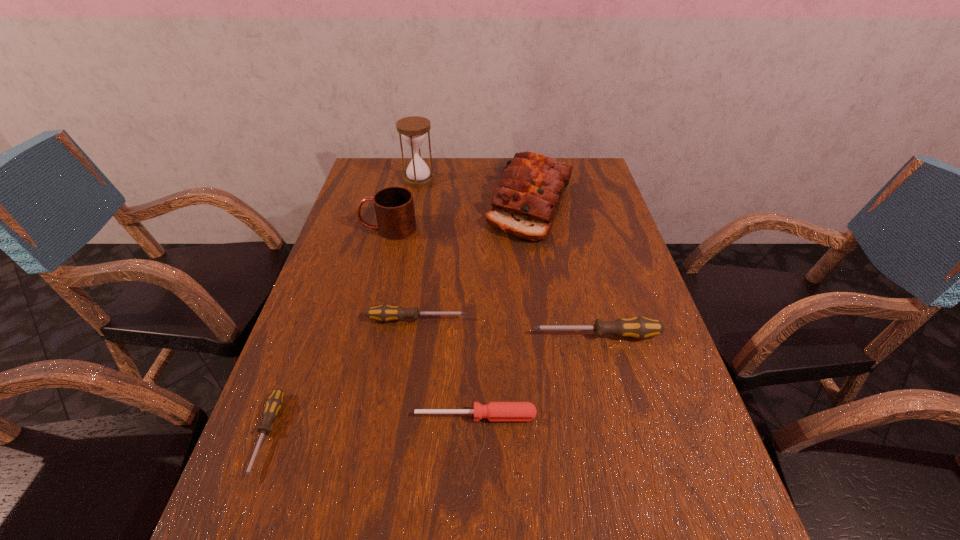
This screenshot has width=960, height=540. I want to click on hourglass present at the far edge, so click(x=414, y=129).

Where is `bread that is at the far edge`? Image resolution: width=960 pixels, height=540 pixels. bread that is at the far edge is located at coordinates click(x=525, y=203).

Where is `hourglass that is positioned at the left edge`? The height and width of the screenshot is (540, 960). hourglass that is positioned at the left edge is located at coordinates (414, 129).

Find the location of `mug situated at the left edge`. mug situated at the left edge is located at coordinates (394, 206).

At what (x,y) coordinates should I click in order to perform the action: click on bread at the right edge. Please return your answer as a coordinate pair (x, y). The height and width of the screenshot is (540, 960). Looking at the image, I should click on (525, 203).

Identify the location of screwdriver that is at the right edge. This screenshot has width=960, height=540. (638, 327).

Identify the location of object located at the far left corner. The width and height of the screenshot is (960, 540). (414, 129).

Find the location of a particular element. The image size is (960, 540). object situated at the far right corner is located at coordinates (525, 203).

In order to click on vacant space at the far edge of the desktop in this screenshot , I will do `click(445, 161)`.

The width and height of the screenshot is (960, 540). In order to click on vacant space at the left edge of the desktop in this screenshot , I will do `click(327, 373)`.